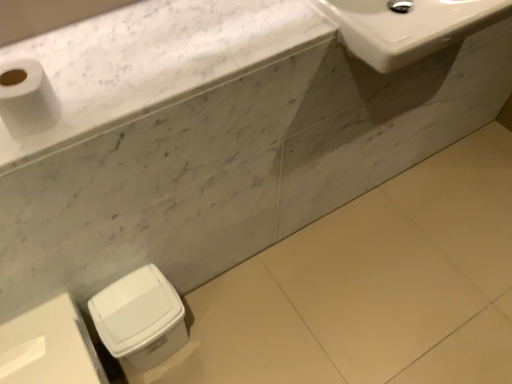
Question: Is white glossy sink at upper right completely or partially outside of white matte toilet paper at upper left?

Choices:
 (A) no
 (B) yes

Answer: (B)

Question: Can you confirm if white glossy sink at upper right is shorter than white matte toilet paper at upper left?

Choices:
 (A) no
 (B) yes

Answer: (A)

Question: Is white glossy sink at upper right to the right of white matte toilet paper at upper left from the viewer's perspective?

Choices:
 (A) no
 (B) yes

Answer: (B)

Question: Is white glossy sink at upper right taller than white matte toilet paper at upper left?

Choices:
 (A) yes
 (B) no

Answer: (A)

Question: Considering the relative sizes of white glossy sink at upper right and white matte toilet paper at upper left in the image provided, is white glossy sink at upper right thinner than white matte toilet paper at upper left?

Choices:
 (A) yes
 (B) no

Answer: (B)

Question: Is white glossy sink at upper right smaller than white matte toilet paper at upper left?

Choices:
 (A) no
 (B) yes

Answer: (A)

Question: Can you confirm if white plastic trash can at lower left, marked as the second porcelain in a left-to-right arrangement, is thinner than white marble countertop at upper left?

Choices:
 (A) yes
 (B) no

Answer: (A)

Question: Is white plastic trash can at lower left, marked as the 1th porcelain in a right-to-left arrangement, facing towards white marble countertop at upper left?

Choices:
 (A) yes
 (B) no

Answer: (B)

Question: Considering the relative sizes of white plastic trash can at lower left, marked as the second porcelain in a left-to-right arrangement, and white marble countertop at upper left in the image provided, is white plastic trash can at lower left, marked as the second porcelain in a left-to-right arrangement, shorter than white marble countertop at upper left?

Choices:
 (A) yes
 (B) no

Answer: (B)

Question: Is white plastic trash can at lower left, marked as the 1th porcelain in a right-to-left arrangement, completely or partially outside of white marble countertop at upper left?

Choices:
 (A) no
 (B) yes

Answer: (B)

Question: Does white plastic trash can at lower left, marked as the 1th porcelain in a right-to-left arrangement, have a smaller size compared to white marble countertop at upper left?

Choices:
 (A) yes
 (B) no

Answer: (B)

Question: Is there a large distance between white plastic trash can at lower left, marked as the 1th porcelain in a right-to-left arrangement, and white marble countertop at upper left?

Choices:
 (A) yes
 (B) no

Answer: (B)

Question: Can you confirm if white plastic trash can at lower left, marked as the second porcelain in a left-to-right arrangement, is positioned to the left of white matte toilet paper at upper left?

Choices:
 (A) no
 (B) yes

Answer: (A)